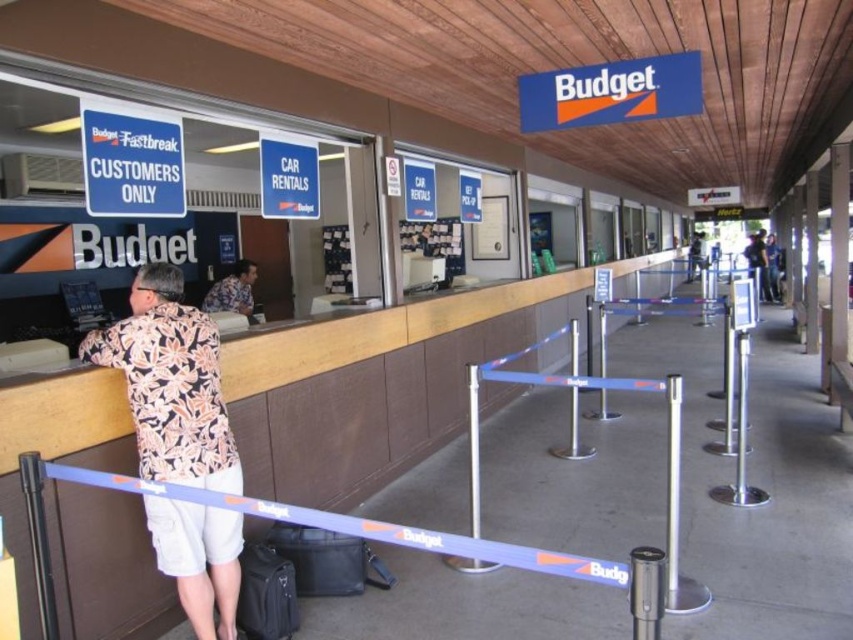
Question: Which point is closer to the camera taking this photo?

Choices:
 (A) (340, 576)
 (B) (144, 346)
 (C) (256, 625)
 (D) (251, 292)

Answer: (B)

Question: Does hawaiian print shirt at left appear on the left side of black leather suitcase at lower center?

Choices:
 (A) yes
 (B) no

Answer: (A)

Question: Estimate the real-world distances between objects in this image. Which object is closer to the hawaiian print shirt at left?

Choices:
 (A) floral shirt at center
 (B) black leather suitcase at lower center

Answer: (B)

Question: Is hawaiian print shirt at left positioned at the back of floral shirt at center?

Choices:
 (A) no
 (B) yes

Answer: (A)

Question: Considering the relative positions of hawaiian print shirt at left and black fabric suitcase at lower left in the image provided, where is hawaiian print shirt at left located with respect to black fabric suitcase at lower left?

Choices:
 (A) left
 (B) right

Answer: (A)

Question: Which point is closer to the camera taking this photo?

Choices:
 (A) (357, 586)
 (B) (219, 406)
 (C) (282, 630)

Answer: (B)